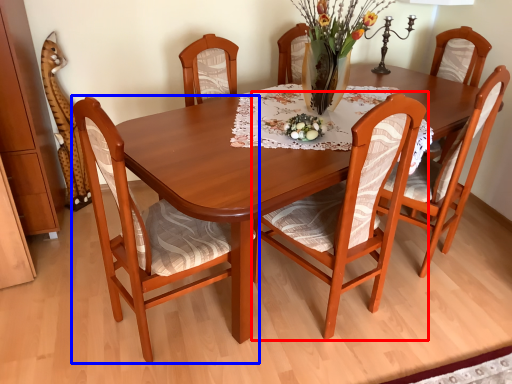
Question: Which of the following is the closest to the observer, chair (highlighted by a red box) or chair (highlighted by a blue box)?

Choices:
 (A) chair
 (B) chair

Answer: (B)